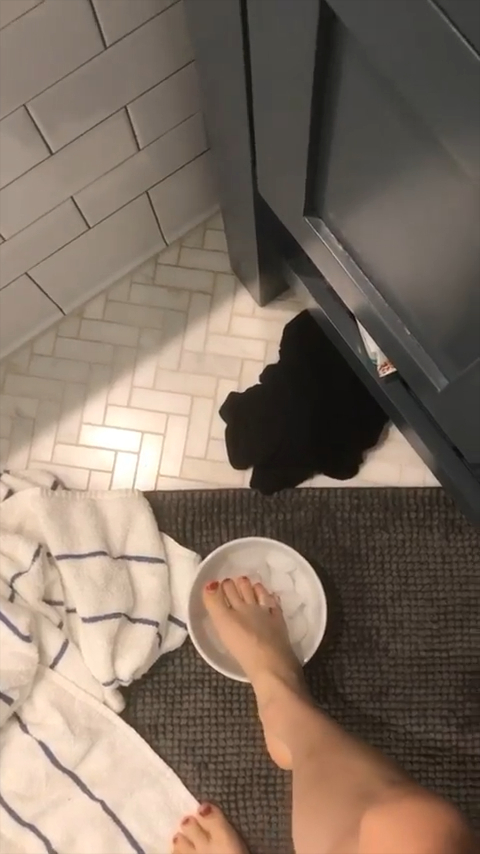
Locate an element on the screen. The width and height of the screenshot is (480, 854). grey furniture is located at coordinates (272, 126).